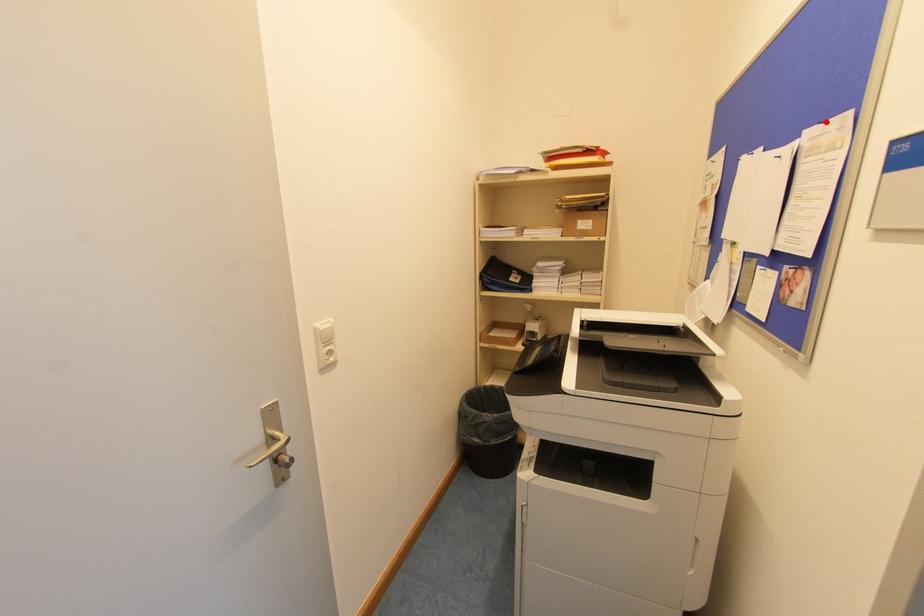
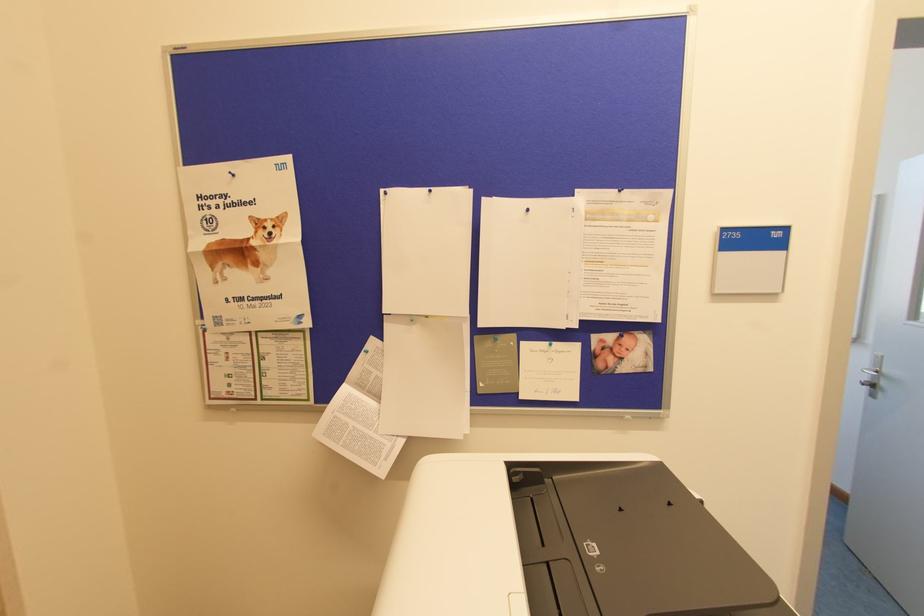
In the second image, find the point that corresponds to the highlighted location in the first image.

(619, 190)